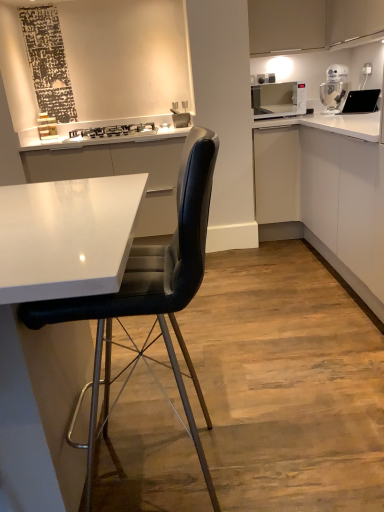
Question: Is black glass stove at upper center wider or thinner than black glossy sink at upper right?

Choices:
 (A) wide
 (B) thin

Answer: (A)

Question: From their relative heights in the image, would you say black glass stove at upper center is taller or shorter than black glossy sink at upper right?

Choices:
 (A) tall
 (B) short

Answer: (B)

Question: Estimate the real-world distances between objects in this image. Which object is closer to the white glossy stand mixer at upper right?

Choices:
 (A) white glossy cabinet at right, marked as the third cabinetry in a top-to-bottom arrangement
 (B) white glossy microwave at upper right
 (C) black leather chair at center
 (D) black glass stove at upper center
 (E) black glossy sink at upper right

Answer: (E)

Question: Estimate the real-world distances between objects in this image. Which object is farther from the white matte cabinet at center-right, the second cabinetry when ordered from bottom to top?

Choices:
 (A) white glossy cabinet at right, marked as the third cabinetry in a top-to-bottom arrangement
 (B) black glossy sink at upper right
 (C) white glossy stand mixer at upper right
 (D) black glass stove at upper center
 (E) matte white cabinet at upper right, the third cabinetry when ordered from bottom to top

Answer: (D)